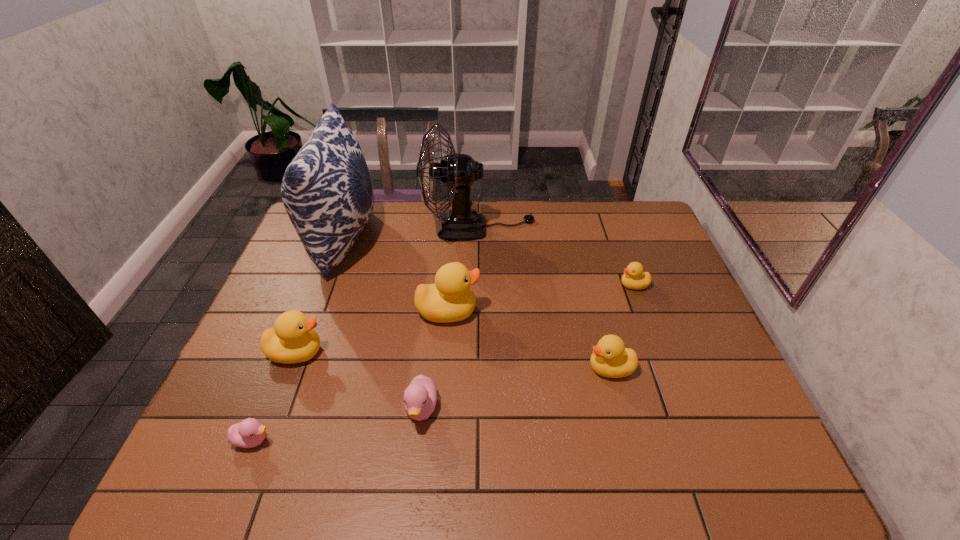
At what (x,y) coordinates should I click in order to perform the action: click on cushion. Please return your answer as a coordinate pair (x, y). The width and height of the screenshot is (960, 540). Looking at the image, I should click on click(327, 191).

Image resolution: width=960 pixels, height=540 pixels. Identify the location of black fan. (458, 172).

Identify the location of the third nearest yellow duckling. pos(450,299).

The height and width of the screenshot is (540, 960). I want to click on the biggest yellow duckling, so click(x=450, y=299).

The width and height of the screenshot is (960, 540). In order to click on the fourth tallest object in this screenshot , I will do coord(293,339).

You are a GUI agent. You are given a task and a screenshot of the screen. Output one action in this format:
    pyautogui.click(x=<x>, y=<y>)
    Task: Click on the third smallest yellow duckling
    The width and height of the screenshot is (960, 540).
    Given the screenshot: What is the action you would take?
    pyautogui.click(x=293, y=339)

The width and height of the screenshot is (960, 540). What are the coordinates of `the second object from right to left` in the screenshot? It's located at (610, 358).

The height and width of the screenshot is (540, 960). I want to click on the second duckling from right to left, so click(610, 358).

Find the location of a particular element. This screenshot has width=960, height=540. the bigger pink duckling is located at coordinates (420, 397).

What are the coordinates of `the rightmost object` in the screenshot? It's located at (634, 278).